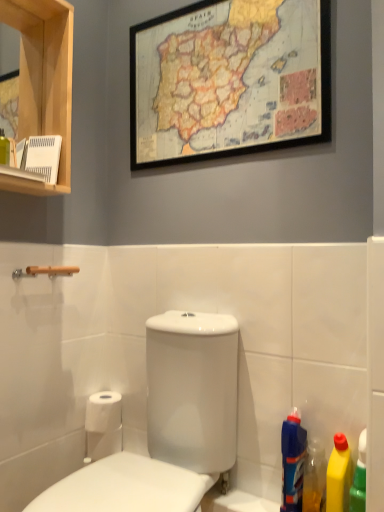
Question: Is translucent plastic bottle at lower right, positioned as the 2th cleaning product in left-to-right order, wider than wooden-framed map at upper center?

Choices:
 (A) no
 (B) yes

Answer: (B)

Question: From the image's perspective, is translucent plastic bottle at lower right, which appears as the second cleaning product when viewed from the right, on top of wooden-framed map at upper center?

Choices:
 (A) yes
 (B) no

Answer: (B)

Question: Is translucent plastic bottle at lower right, which appears as the second cleaning product when viewed from the right, next to wooden-framed map at upper center?

Choices:
 (A) yes
 (B) no

Answer: (B)

Question: Can you confirm if translucent plastic bottle at lower right, positioned as the 2th cleaning product in left-to-right order, is smaller than wooden-framed map at upper center?

Choices:
 (A) no
 (B) yes

Answer: (B)

Question: Is translucent plastic bottle at lower right, positioned as the 2th cleaning product in left-to-right order, at the right side of wooden-framed map at upper center?

Choices:
 (A) no
 (B) yes

Answer: (B)

Question: Is point (240, 6) positioned closer to the camera than point (340, 464)?

Choices:
 (A) farther
 (B) closer

Answer: (A)

Question: From the image's perspective, relative to yellow plastic bottle at lower right, which is counted as the first cleaning product, starting from the right, is wooden-framed map at upper center above or below?

Choices:
 (A) above
 (B) below

Answer: (A)

Question: Do you think wooden-framed map at upper center is within yellow plastic bottle at lower right, which is counted as the 3th cleaning product, starting from the left, or outside of it?

Choices:
 (A) outside
 (B) inside

Answer: (A)

Question: Visually, is wooden-framed map at upper center positioned to the left or to the right of yellow plastic bottle at lower right, which is counted as the 3th cleaning product, starting from the left?

Choices:
 (A) right
 (B) left

Answer: (B)

Question: Is point (349, 475) positioned closer to the camera than point (104, 488)?

Choices:
 (A) farther
 (B) closer

Answer: (B)

Question: From a real-world perspective, relative to white glossy toilet at center, is yellow plastic bottle at lower right, which is counted as the 3th cleaning product, starting from the left, vertically above or below?

Choices:
 (A) below
 (B) above

Answer: (A)

Question: Is yellow plastic bottle at lower right, which is counted as the first cleaning product, starting from the right, to the left or to the right of white glossy toilet at center in the image?

Choices:
 (A) right
 (B) left

Answer: (A)

Question: From the image's perspective, is yellow plastic bottle at lower right, which is counted as the 3th cleaning product, starting from the left, located above or below white glossy toilet at center?

Choices:
 (A) above
 (B) below

Answer: (B)

Question: Do you think blue plastic bottle at lower right, acting as the 1th cleaning product starting from the left, is within white glossy toilet at center, or outside of it?

Choices:
 (A) inside
 (B) outside

Answer: (B)

Question: Considering the positions of blue plastic bottle at lower right, which ranks as the 3th cleaning product in right-to-left order, and white glossy toilet at center in the image, is blue plastic bottle at lower right, which ranks as the 3th cleaning product in right-to-left order, bigger or smaller than white glossy toilet at center?

Choices:
 (A) small
 (B) big

Answer: (A)